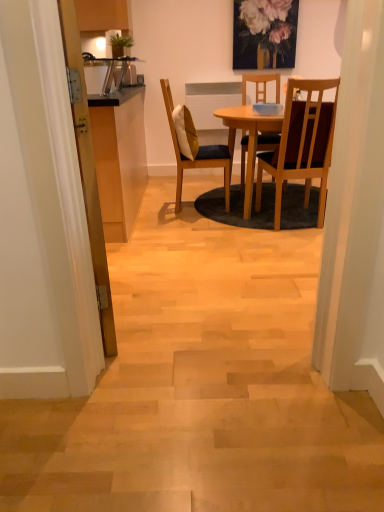
At what (x,y) coordinates should I click in order to perform the action: click on vacant area that lies between wooden door at left and brown wooden chair at center, marked as the second chair in a left-to-right arrangement. Please return your answer as a coordinate pair (x, y). Image resolution: width=384 pixels, height=512 pixels. Looking at the image, I should click on [198, 267].